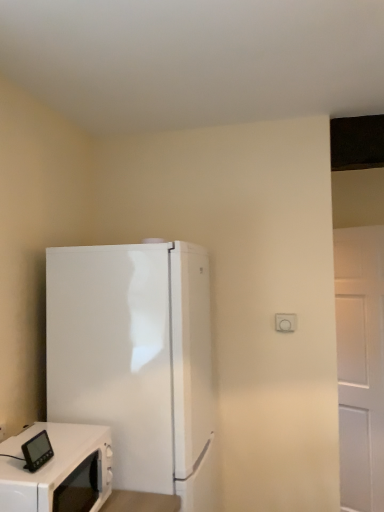
What do you see at coordinates (53, 465) in the screenshot? I see `white glossy microwave at lower left` at bounding box center [53, 465].

This screenshot has width=384, height=512. What are the coordinates of `white glossy microwave at lower left` in the screenshot? It's located at (53, 465).

Measure the distance between white glossy microwave at lower left and camera.

white glossy microwave at lower left is 1.10 meters from camera.

You are a GUI agent. You are given a task and a screenshot of the screen. Output one action in this format:
    pyautogui.click(x=<x>, y=<y>)
    Task: Click on the white glossy refrigerator at left
    
    Given the screenshot: What is the action you would take?
    pyautogui.click(x=137, y=361)

This screenshot has width=384, height=512. Describe the element at coordinates (137, 361) in the screenshot. I see `white glossy refrigerator at left` at that location.

You are a GUI agent. You are given a task and a screenshot of the screen. Output one action in this format:
    pyautogui.click(x=<x>, y=<y>)
    Task: Click on the white glossy microwave at lower left
    The height and width of the screenshot is (512, 384).
    Given the screenshot: What is the action you would take?
    pyautogui.click(x=53, y=465)

Does white glossy refrigerator at left appear on the left side of white glossy microwave at lower left?

No, white glossy refrigerator at left is not to the left of white glossy microwave at lower left.

Considering the positions of objects white glossy refrigerator at left and white glossy microwave at lower left in the image provided, who is behind, white glossy refrigerator at left or white glossy microwave at lower left?

white glossy refrigerator at left is more distant.

Between point (124, 306) and point (7, 443), which one is positioned behind?

The point (124, 306) is farther from the camera.

Looking at this image, from the image's perspective, which object appears higher, white glossy refrigerator at left or white glossy microwave at lower left?

white glossy refrigerator at left is shown above in the image.

From a real-world perspective, who is located lower, white glossy refrigerator at left or white glossy microwave at lower left?

In real-world perspective, white glossy microwave at lower left is lower.

Between white glossy refrigerator at left and white glossy microwave at lower left, which one has larger width?

white glossy refrigerator at left.

Considering the relative sizes of white glossy refrigerator at left and white glossy microwave at lower left in the image provided, is white glossy refrigerator at left shorter than white glossy microwave at lower left?

In fact, white glossy refrigerator at left may be taller than white glossy microwave at lower left.

Is white glossy refrigerator at left bigger or smaller than white glossy microwave at lower left?

Considering their sizes, white glossy refrigerator at left takes up more space than white glossy microwave at lower left.

Which is correct: white glossy refrigerator at left is inside white glossy microwave at lower left, or outside of it?

The correct answer is: outside.

Would you consider white glossy refrigerator at left to be distant from white glossy microwave at lower left?

white glossy refrigerator at left is actually quite close to white glossy microwave at lower left.

Is white glossy refrigerator at left positioned with its back to white glossy microwave at lower left?

No, white glossy refrigerator at left's orientation is not away from white glossy microwave at lower left.

The width and height of the screenshot is (384, 512). I want to click on home appliance below the white glossy refrigerator at left (from the image's perspective), so click(x=53, y=465).

In the image, is white glossy microwave at lower left on the left side or the right side of white glossy refrigerator at left?

Clearly, white glossy microwave at lower left is on the left of white glossy refrigerator at left in the image.

Considering the relative positions of white glossy microwave at lower left and white glossy refrigerator at left in the image provided, is white glossy microwave at lower left in front of white glossy refrigerator at left?

Yes.

Which point is more forward, [9,486] or [196,476]?

Positioned in front is point [9,486].

From the image's perspective, which is above, white glossy microwave at lower left or white glossy refrigerator at left?

white glossy refrigerator at left.

From a real-world perspective, is white glossy microwave at lower left under white glossy refrigerator at left?

Correct, in the physical world, white glossy microwave at lower left is lower than white glossy refrigerator at left.

Considering the sizes of objects white glossy microwave at lower left and white glossy refrigerator at left in the image provided, who is wider, white glossy microwave at lower left or white glossy refrigerator at left?

white glossy refrigerator at left is wider.

Considering the relative sizes of white glossy microwave at lower left and white glossy refrigerator at left in the image provided, is white glossy microwave at lower left shorter than white glossy refrigerator at left?

Yes, white glossy microwave at lower left is shorter than white glossy refrigerator at left.

Is white glossy microwave at lower left bigger than white glossy refrigerator at left?

No.

Is white glossy microwave at lower left outside of white glossy refrigerator at left?

Indeed, white glossy microwave at lower left is completely outside white glossy refrigerator at left.

Is white glossy microwave at lower left beside white glossy refrigerator at left?

No, white glossy microwave at lower left is not beside white glossy refrigerator at left.

Is white glossy refrigerator at left at the back of white glossy microwave at lower left?

That's not correct — white glossy microwave at lower left is not looking away from white glossy refrigerator at left.

How distant is white glossy microwave at lower left from white glossy refrigerator at left?

white glossy microwave at lower left is 33.25 centimeters from white glossy refrigerator at left.

This screenshot has width=384, height=512. I want to click on home appliance on the left of white glossy refrigerator at left, so click(x=53, y=465).

At what (x,y) coordinates should I click in order to perform the action: click on home appliance below the white glossy refrigerator at left (from a real-world perspective). Please return your answer as a coordinate pair (x, y). This screenshot has width=384, height=512. Looking at the image, I should click on (53, 465).

Identify the location of refrigerator above the white glossy microwave at lower left (from a real-world perspective). (137, 361).